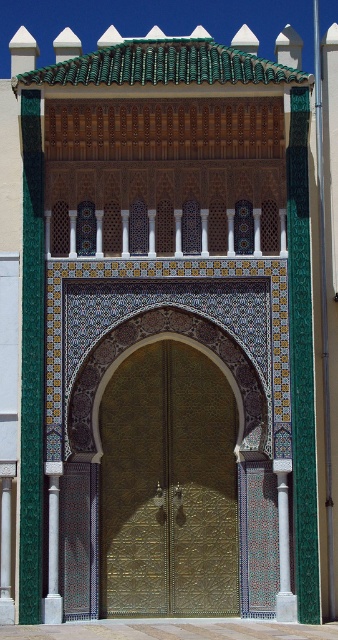
Question: Can you confirm if gold textured door at center is thinner than white marble column at center?

Choices:
 (A) no
 (B) yes

Answer: (A)

Question: Which of the following is the farthest from the observer?

Choices:
 (A) (225, 579)
 (B) (60, 474)
 (C) (277, 481)

Answer: (A)

Question: Can you confirm if gold textured door at center is wider than white marble column at center?

Choices:
 (A) yes
 (B) no

Answer: (A)

Question: Which object is the farthest from the white marble column at center?

Choices:
 (A) green stone column at left
 (B) gold textured door at center

Answer: (A)

Question: Which of the following is the farthest from the observer?

Choices:
 (A) (58, 614)
 (B) (126, 424)
 (C) (286, 564)

Answer: (B)

Question: Does gold textured door at center have a greater width compared to green stone column at left?

Choices:
 (A) yes
 (B) no

Answer: (A)